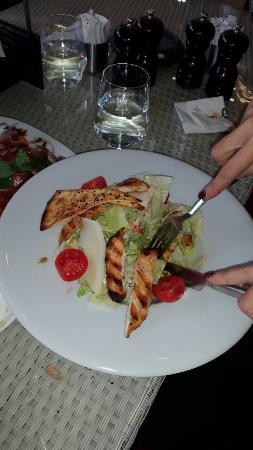
I want to click on plate, so click(x=87, y=350).